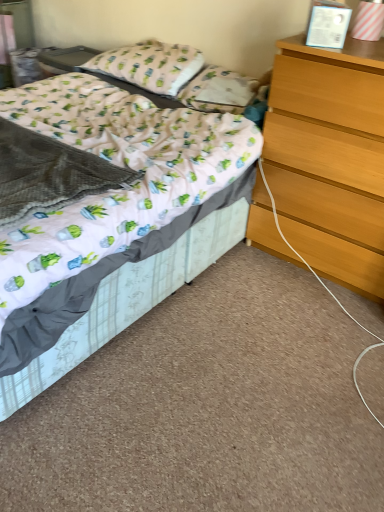
Question: Does white fabric pillow at upper center, the second pillow viewed from the right, turn towards light brown wooden chest of drawers at right?

Choices:
 (A) no
 (B) yes

Answer: (A)

Question: Can you confirm if white fabric pillow at upper center, the second pillow viewed from the right, is thinner than light brown wooden chest of drawers at right?

Choices:
 (A) yes
 (B) no

Answer: (A)

Question: Is white fabric pillow at upper center, the second pillow viewed from the right, behind light brown wooden chest of drawers at right?

Choices:
 (A) no
 (B) yes

Answer: (B)

Question: Is white fabric pillow at upper center, the first pillow viewed from the left, shorter than light brown wooden chest of drawers at right?

Choices:
 (A) no
 (B) yes

Answer: (B)

Question: Is white fabric pillow at upper center, the second pillow viewed from the right, positioned with its back to light brown wooden chest of drawers at right?

Choices:
 (A) yes
 (B) no

Answer: (B)

Question: Considering the positions of point (135, 49) and point (193, 83), is point (135, 49) closer or farther from the camera than point (193, 83)?

Choices:
 (A) closer
 (B) farther

Answer: (B)

Question: Looking at their shapes, would you say white fabric pillow at upper center, the first pillow viewed from the left, is wider or thinner than white fabric pillow at center, positioned as the second pillow in left-to-right order?

Choices:
 (A) thin
 (B) wide

Answer: (B)

Question: From a real-world perspective, is white fabric pillow at upper center, the second pillow viewed from the right, physically located above or below white fabric pillow at center, the 1th pillow in the right-to-left sequence?

Choices:
 (A) above
 (B) below

Answer: (A)

Question: Which is correct: white fabric pillow at upper center, the first pillow viewed from the left, is inside white fabric pillow at center, positioned as the second pillow in left-to-right order, or outside of it?

Choices:
 (A) outside
 (B) inside

Answer: (A)

Question: Considering the positions of light brown wooden chest of drawers at right and white fabric bed at center in the image, is light brown wooden chest of drawers at right wider or thinner than white fabric bed at center?

Choices:
 (A) thin
 (B) wide

Answer: (A)

Question: In terms of size, does light brown wooden chest of drawers at right appear bigger or smaller than white fabric bed at center?

Choices:
 (A) big
 (B) small

Answer: (B)

Question: Is light brown wooden chest of drawers at right to the left or to the right of white fabric bed at center in the image?

Choices:
 (A) right
 (B) left

Answer: (A)

Question: Which is correct: light brown wooden chest of drawers at right is inside white fabric bed at center, or outside of it?

Choices:
 (A) outside
 (B) inside

Answer: (A)

Question: From a real-world perspective, is light brown wooden chest of drawers at right positioned above or below white fabric pillow at center, the 1th pillow in the right-to-left sequence?

Choices:
 (A) below
 (B) above

Answer: (A)

Question: Considering their positions, is light brown wooden chest of drawers at right located in front of or behind white fabric pillow at center, the 1th pillow in the right-to-left sequence?

Choices:
 (A) front
 (B) behind

Answer: (A)